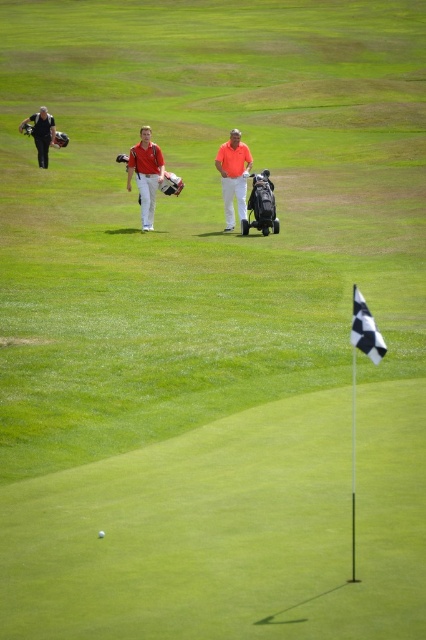
Question: Considering the real-world distances, which object is farthest from the matte orange shirt at center?

Choices:
 (A) black checkered flag at center
 (B) matte black golf bag at left

Answer: (B)

Question: Among these points, which one is nearest to the camera?

Choices:
 (A) (40, 156)
 (B) (367, 355)
 (C) (144, 144)
 (D) (244, 189)

Answer: (B)

Question: Which object appears farthest from the camera in this image?

Choices:
 (A) matte black golf bag at left
 (B) white matte golf ball at center

Answer: (A)

Question: From the image, what is the correct spatial relationship of matte orange shirt at center in relation to matte red shirt at center?

Choices:
 (A) left
 (B) right

Answer: (B)

Question: Does matte orange shirt at center appear on the right side of matte red shirt at center?

Choices:
 (A) yes
 (B) no

Answer: (A)

Question: Does matte orange shirt at center have a lesser width compared to white matte golf ball at center?

Choices:
 (A) yes
 (B) no

Answer: (B)